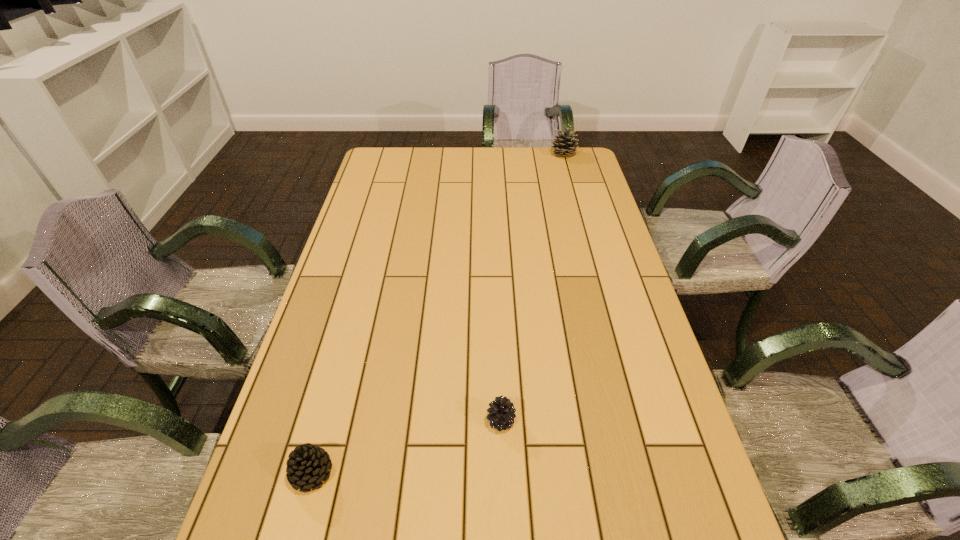
At what (x,y) coordinates should I click in order to perform the action: click on free point between the leftmost object and the tallest pinecone. Please return your answer as a coordinate pair (x, y). This screenshot has width=960, height=540. Looking at the image, I should click on (438, 314).

Image resolution: width=960 pixels, height=540 pixels. I want to click on vacant space that's between the farthest pinecone and the leftmost pinecone, so click(438, 314).

This screenshot has height=540, width=960. Find the location of `vacant area that lies between the tallest pinecone and the second nearest pinecone`. vacant area that lies between the tallest pinecone and the second nearest pinecone is located at coordinates (532, 288).

Locate an element on the screen. This screenshot has height=540, width=960. free area in between the nearest object and the second object from right to left is located at coordinates (406, 447).

Locate an element on the screen. vacant area that lies between the nearest object and the rightmost object is located at coordinates (438, 314).

I want to click on vacant space in between the second farthest object and the farthest pinecone, so click(532, 288).

Select which object appears as the second closest to the tallest object. Please provide its 2D coordinates. Your answer should be formatted as a tuple, i.e. [(x, y)], where the tuple contains the x and y coordinates of a point satisfying the conditions above.

[(308, 465)]

In order to click on object that is the closest one to the second farthest pinecone in this screenshot , I will do `click(308, 465)`.

At what (x,y) coordinates should I click in order to perform the action: click on pinecone that can be found as the closest to the second farthest object. Please return your answer as a coordinate pair (x, y). Looking at the image, I should click on (308, 465).

Where is `pinecone that can be found as the closest to the farthest pinecone`? pinecone that can be found as the closest to the farthest pinecone is located at coordinates (501, 415).